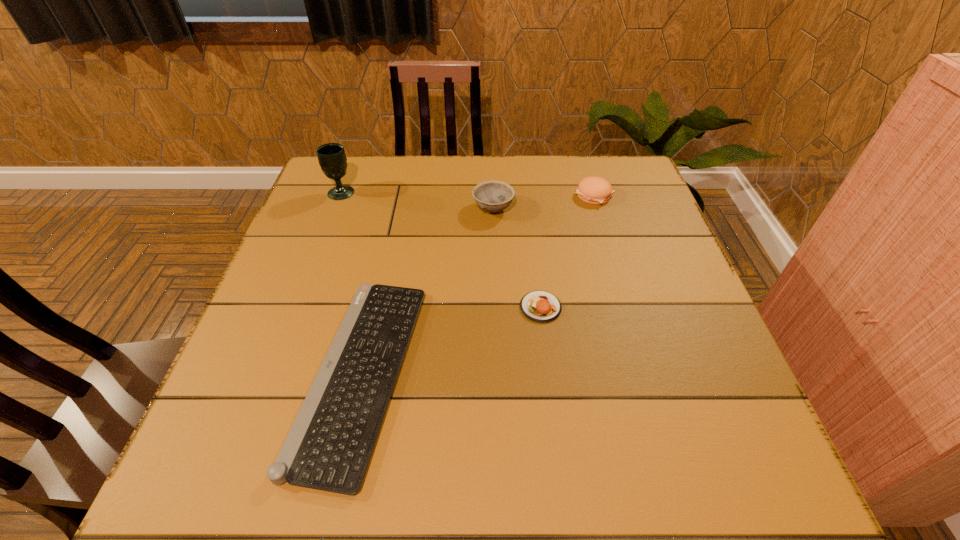
Locate an element on the screen. vacant point located between the fourth shortest object and the shorter patty (food) is located at coordinates (516, 258).

Locate an element on the screen. The height and width of the screenshot is (540, 960). blank region between the tallest object and the second object from left to right is located at coordinates (351, 282).

You are a GUI agent. You are given a task and a screenshot of the screen. Output one action in this format:
    pyautogui.click(x=<x>, y=<y>)
    Task: Click on the empty space that is in between the leftmost object and the shorter patty (food)
    
    Given the screenshot: What is the action you would take?
    pyautogui.click(x=441, y=249)

Find the location of a particular element. This screenshot has width=960, height=540. free area in between the chalice and the computer keyboard is located at coordinates (351, 282).

Image resolution: width=960 pixels, height=540 pixels. I want to click on vacant space in between the computer keyboard and the third tallest object, so click(x=477, y=285).

Locate an element on the screen. The width and height of the screenshot is (960, 540). free space between the farther patty (food) and the tallest object is located at coordinates (468, 194).

The height and width of the screenshot is (540, 960). In order to click on vacant area between the leftmost object and the third tallest object in this screenshot , I will do `click(468, 194)`.

Identify the location of empty location between the computer keyboard and the shorter patty (food). Image resolution: width=960 pixels, height=540 pixels. (450, 340).

Select which object is the second closest to the bowl. Please provide its 2D coordinates. Your answer should be formatted as a tuple, i.e. [(x, y)], where the tuple contains the x and y coordinates of a point satisfying the conditions above.

[(539, 306)]

Locate which object ranks third in proximity to the rightmost object. Please provide its 2D coordinates. Your answer should be formatted as a tuple, i.e. [(x, y)], where the tuple contains the x and y coordinates of a point satisfying the conditions above.

[(329, 446)]